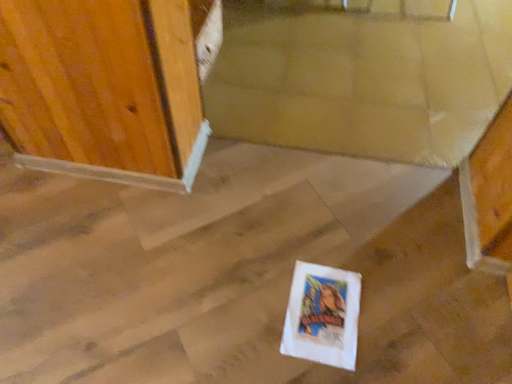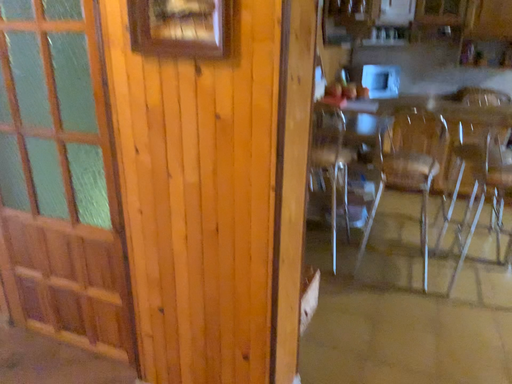
Question: How did the camera likely rotate when shooting the video?

Choices:
 (A) rotated right
 (B) rotated left

Answer: (B)